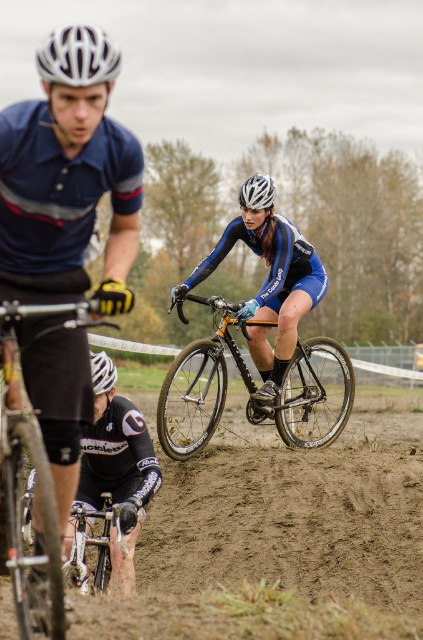
Which of these two, shiny black bike at center or white matte bicycle helmet at upper left, stands shorter?

white matte bicycle helmet at upper left is shorter.

Who is taller, shiny black bike at center or white matte bicycle helmet at upper left?

With more height is shiny black bike at center.

Who is more distant from viewer, (286, 413) or (43, 72)?

Positioned behind is point (286, 413).

Locate an element on the screen. shiny black bike at center is located at coordinates (198, 384).

Is point (85, 40) positioned after point (110, 381)?

No, (85, 40) is in front of (110, 381).

Is white matte bicycle helmet at upper left positioned at the back of white matte bicycle helmet at center?

No, it is in front of white matte bicycle helmet at center.

The width and height of the screenshot is (423, 640). In order to click on white matte bicycle helmet at upper left in this screenshot , I will do `click(77, 56)`.

Where is `white matte bicycle helmet at upper left`? white matte bicycle helmet at upper left is located at coordinates (77, 56).

Between matte black helmet at center and white matte bicycle helmet at center, which one is positioned lower?

white matte bicycle helmet at center

Does matte black helmet at center have a greater height compared to white matte bicycle helmet at center?

Indeed, matte black helmet at center has a greater height compared to white matte bicycle helmet at center.

At what (x,y) coordinates should I click in order to perform the action: click on matte black helmet at center. Please return your answer as a coordinate pair (x, y). The width and height of the screenshot is (423, 640). Looking at the image, I should click on (257, 192).